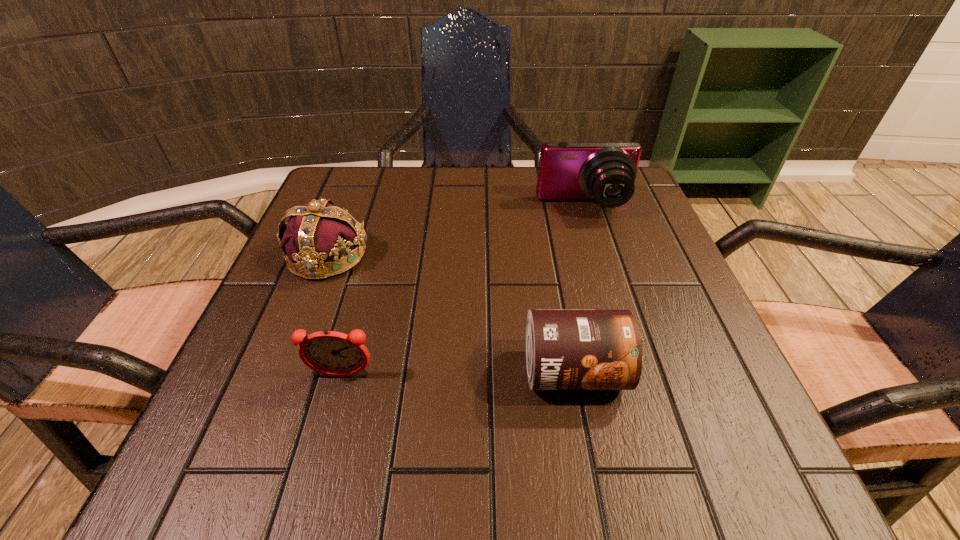
At what (x,y) coordinates should I click in order to perform the action: click on camera. Please return your answer as a coordinate pair (x, y). The height and width of the screenshot is (540, 960). Looking at the image, I should click on (603, 171).

The height and width of the screenshot is (540, 960). What are the coordinates of `crown` in the screenshot? It's located at (318, 233).

Identify the location of can. The width and height of the screenshot is (960, 540). (565, 349).

At what (x,y) coordinates should I click in order to perform the action: click on alarm clock. Please return your answer as a coordinate pair (x, y). This screenshot has width=960, height=540. Looking at the image, I should click on (331, 353).

This screenshot has height=540, width=960. What are the coordinates of `free space located 0.370m on the front-facing side of the farthest object` in the screenshot? It's located at coord(632,362).

Where is `vacant space positioned on the right of the crown`? This screenshot has height=540, width=960. vacant space positioned on the right of the crown is located at coordinates (407, 255).

Identify the location of vacant space located on the front label of the can. This screenshot has width=960, height=540. (592, 477).

At what (x,y) coordinates should I click in order to perform the action: click on vacant point located on the front-facing side of the alarm clock. Please return your answer as a coordinate pair (x, y). The height and width of the screenshot is (540, 960). Looking at the image, I should click on (314, 478).

In order to click on object present at the far edge in this screenshot , I will do `click(603, 171)`.

You are a GUI agent. You are given a task and a screenshot of the screen. Output one action in this format:
    pyautogui.click(x=<x>, y=<y>)
    Task: Click on the crown that is at the left edge
    This screenshot has width=960, height=540.
    Given the screenshot: What is the action you would take?
    pyautogui.click(x=318, y=233)